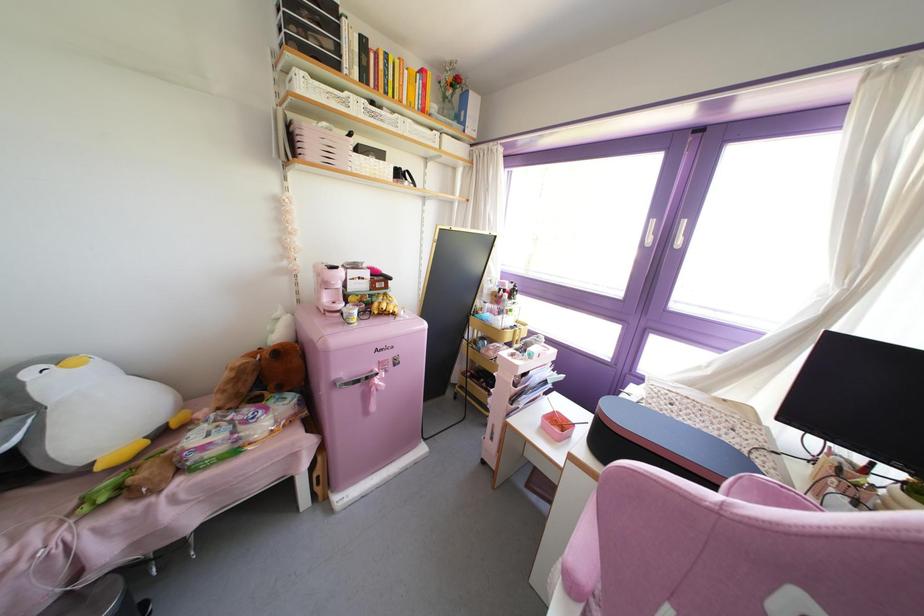
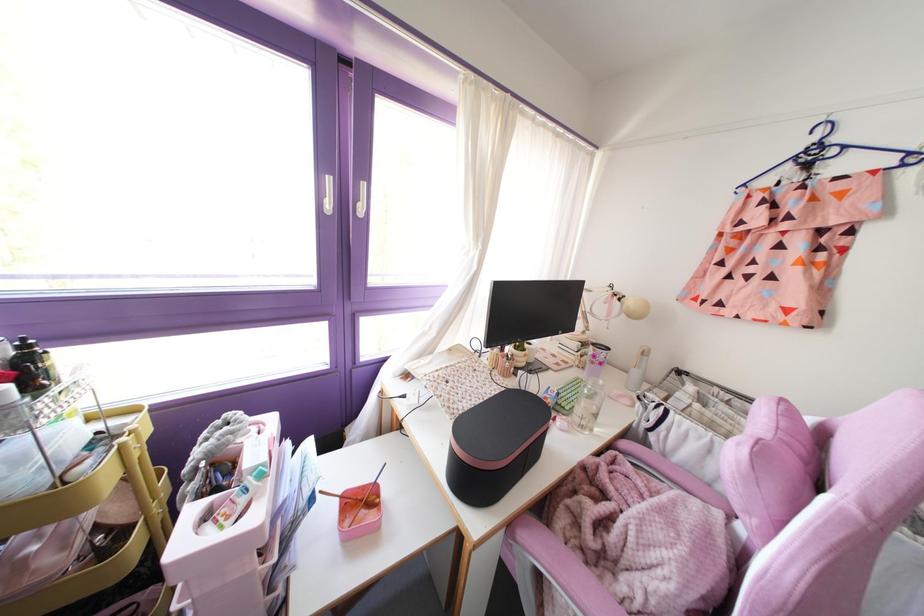
Find the pixel in the second image that matches [524,323] in the first image.

(130, 411)